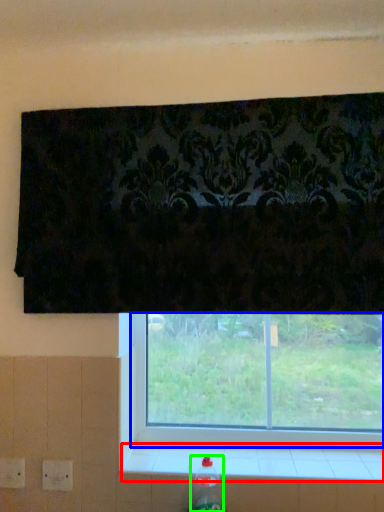
Question: Which object is the closest to the window sill (highlighted by a red box)? Choose among these: window (highlighted by a blue box) or bottle (highlighted by a green box).

Choices:
 (A) window
 (B) bottle

Answer: (A)